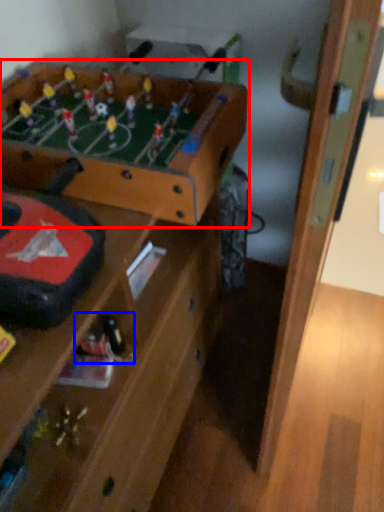
Question: Which point is further to the camera, table (highlighted by a red box) or toy (highlighted by a blue box)?

Choices:
 (A) table
 (B) toy

Answer: (B)